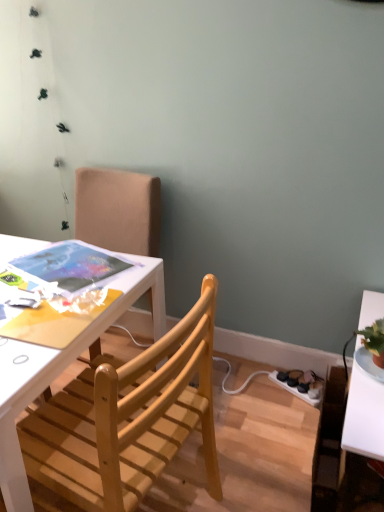
Image resolution: width=384 pixels, height=512 pixels. What do you see at coordinates (118, 210) in the screenshot? I see `wooden chair at upper left, which is counted as the first chair, starting from the back` at bounding box center [118, 210].

Where is `light wood chair at center, arranged as the second chair when viewed from the back`? The width and height of the screenshot is (384, 512). light wood chair at center, arranged as the second chair when viewed from the back is located at coordinates (128, 419).

Is light wood chair at center, which is the 1th chair in front-to-back order, far away from wooden chair at upper left, which is counted as the first chair, starting from the back?

light wood chair at center, which is the 1th chair in front-to-back order, is near wooden chair at upper left, which is counted as the first chair, starting from the back, not far away.

In the image, is light wood chair at center, which is the 1th chair in front-to-back order, on the left side or the right side of wooden chair at upper left, the second chair from the front?

Clearly, light wood chair at center, which is the 1th chair in front-to-back order, is on the right of wooden chair at upper left, the second chair from the front, in the image.

From a real-world perspective, which object stands above the other?

wooden chair at upper left, which is counted as the first chair, starting from the back, from a real-world perspective.

Is wooden chair at upper left, which is counted as the first chair, starting from the back, located within light wood chair at center, which is the 1th chair in front-to-back order?

No.

From the image's perspective, relative to light wood chair at center, arranged as the second chair when viewed from the back, is white plastic power outlet at lower right above or below?

white plastic power outlet at lower right is below light wood chair at center, arranged as the second chair when viewed from the back.

From a real-world perspective, does white plastic power outlet at lower right stand above light wood chair at center, arranged as the second chair when viewed from the back?

Actually, white plastic power outlet at lower right is physically below light wood chair at center, arranged as the second chair when viewed from the back, in the real world.

In the scene shown: Is light wood chair at center, arranged as the second chair when viewed from the back, located within white plastic power outlet at lower right?

Definitely not — light wood chair at center, arranged as the second chair when viewed from the back, is not inside white plastic power outlet at lower right.

Does white plastic power outlet at lower right have a greater width compared to light wood chair at center, arranged as the second chair when viewed from the back?

No, white plastic power outlet at lower right is not wider than light wood chair at center, arranged as the second chair when viewed from the back.

Does point (90, 347) appear closer or farther from the camera than point (73, 479)?

Point (90, 347).

How far apart are wooden chair at upper left, which is counted as the first chair, starting from the back, and light wood chair at center, which is the 1th chair in front-to-back order?

The distance of wooden chair at upper left, which is counted as the first chair, starting from the back, from light wood chair at center, which is the 1th chair in front-to-back order, is 34.19 inches.

From a real-world perspective, is wooden chair at upper left, which is counted as the first chair, starting from the back, above or below light wood chair at center, which is the 1th chair in front-to-back order?

In terms of real-world spatial position, wooden chair at upper left, which is counted as the first chair, starting from the back, is above light wood chair at center, which is the 1th chair in front-to-back order.

Which of these two, wooden chair at upper left, the second chair from the front, or light wood chair at center, arranged as the second chair when viewed from the back, stands shorter?

light wood chair at center, arranged as the second chair when viewed from the back.

Is light wood chair at center, which is the 1th chair in front-to-back order, in front of or behind white plastic power outlet at lower right in the image?

Visually, light wood chair at center, which is the 1th chair in front-to-back order, is located in front of white plastic power outlet at lower right.

Is light wood chair at center, arranged as the second chair when viewed from the back, touching white plastic power outlet at lower right?

No, light wood chair at center, arranged as the second chair when viewed from the back, is not touching white plastic power outlet at lower right.

Is light wood chair at center, which is the 1th chair in front-to-back order, outside of white plastic power outlet at lower right?

Indeed, light wood chair at center, which is the 1th chair in front-to-back order, is completely outside white plastic power outlet at lower right.

How many degrees apart are the facing directions of light wood chair at center, arranged as the second chair when viewed from the back, and white plastic power outlet at lower right?

They differ by 72.9 degrees in their facing directions.

In the image, is white plastic power outlet at lower right positioned in front of or behind wooden chair at upper left, which is counted as the first chair, starting from the back?

In the image, white plastic power outlet at lower right appears behind wooden chair at upper left, which is counted as the first chair, starting from the back.

How different are the orientations of white plastic power outlet at lower right and wooden chair at upper left, the second chair from the front, in degrees?

Result: 24.5 degrees separate the facing orientations of white plastic power outlet at lower right and wooden chair at upper left, the second chair from the front.

Is white plastic power outlet at lower right not inside wooden chair at upper left, which is counted as the first chair, starting from the back?

Yes, white plastic power outlet at lower right is located beyond the bounds of wooden chair at upper left, which is counted as the first chair, starting from the back.

Considering the positions of point (306, 393) and point (153, 219), is point (306, 393) closer or farther from the camera than point (153, 219)?

Point (306, 393) appears to be farther away from the viewer than point (153, 219).

In terms of size, does wooden chair at upper left, which is counted as the first chair, starting from the back, appear bigger or smaller than white plastic power outlet at lower right?

Clearly, wooden chair at upper left, which is counted as the first chair, starting from the back, is larger in size than white plastic power outlet at lower right.

Is wooden chair at upper left, which is counted as the first chair, starting from the back, taller than white plastic power outlet at lower right?

Indeed, wooden chair at upper left, which is counted as the first chair, starting from the back, has a greater height compared to white plastic power outlet at lower right.

From the image's perspective, between wooden chair at upper left, the second chair from the front, and white plastic power outlet at lower right, which one is located above?

wooden chair at upper left, the second chair from the front, appears higher in the image.

Can you confirm if wooden chair at upper left, which is counted as the first chair, starting from the back, is positioned to the left of white plastic power outlet at lower right?

Indeed, wooden chair at upper left, which is counted as the first chair, starting from the back, is positioned on the left side of white plastic power outlet at lower right.

Where is `chair in front of the wooden chair at upper left, the second chair from the front`? chair in front of the wooden chair at upper left, the second chair from the front is located at coordinates (128, 419).

This screenshot has width=384, height=512. Identify the location of power outlet behind the light wood chair at center, arranged as the second chair when viewed from the back. (293, 390).

In the scene shown: When comparing their distances from wooden chair at upper left, the second chair from the front, does light wood chair at center, which is the 1th chair in front-to-back order, or white plastic power outlet at lower right seem further?

white plastic power outlet at lower right lies further to wooden chair at upper left, the second chair from the front, than the other object.

From the image, which object appears to be nearer to light wood chair at center, which is the 1th chair in front-to-back order, white plastic power outlet at lower right or wooden chair at upper left, the second chair from the front?

Among the two, wooden chair at upper left, the second chair from the front, is located nearer to light wood chair at center, which is the 1th chair in front-to-back order.

Based on their spatial positions, is white plastic power outlet at lower right or light wood chair at center, arranged as the second chair when viewed from the back, closer to wooden chair at upper left, which is counted as the first chair, starting from the back?

light wood chair at center, arranged as the second chair when viewed from the back, lies closer to wooden chair at upper left, which is counted as the first chair, starting from the back, than the other object.

Consider the image. When comparing their distances from white plastic power outlet at lower right, does light wood chair at center, which is the 1th chair in front-to-back order, or wooden chair at upper left, which is counted as the first chair, starting from the back, seem further?

wooden chair at upper left, which is counted as the first chair, starting from the back.

From the image, which object appears to be nearer to light wood chair at center, arranged as the second chair when viewed from the back, wooden chair at upper left, which is counted as the first chair, starting from the back, or white plastic power outlet at lower right?

wooden chair at upper left, which is counted as the first chair, starting from the back, is closer to light wood chair at center, arranged as the second chair when viewed from the back.

Considering their positions, is wooden chair at upper left, which is counted as the first chair, starting from the back, positioned further to white plastic power outlet at lower right than light wood chair at center, arranged as the second chair when viewed from the back?

wooden chair at upper left, which is counted as the first chair, starting from the back, is further to white plastic power outlet at lower right.

You are a GUI agent. You are given a task and a screenshot of the screen. Output one action in this format:
    pyautogui.click(x=<x>, y=<y>)
    Task: Click on the chair positioned between light wood chair at center, arranged as the second chair when viewed from the back, and white plastic power outlet at lower right from near to far
    This screenshot has height=512, width=384.
    Given the screenshot: What is the action you would take?
    pyautogui.click(x=118, y=210)